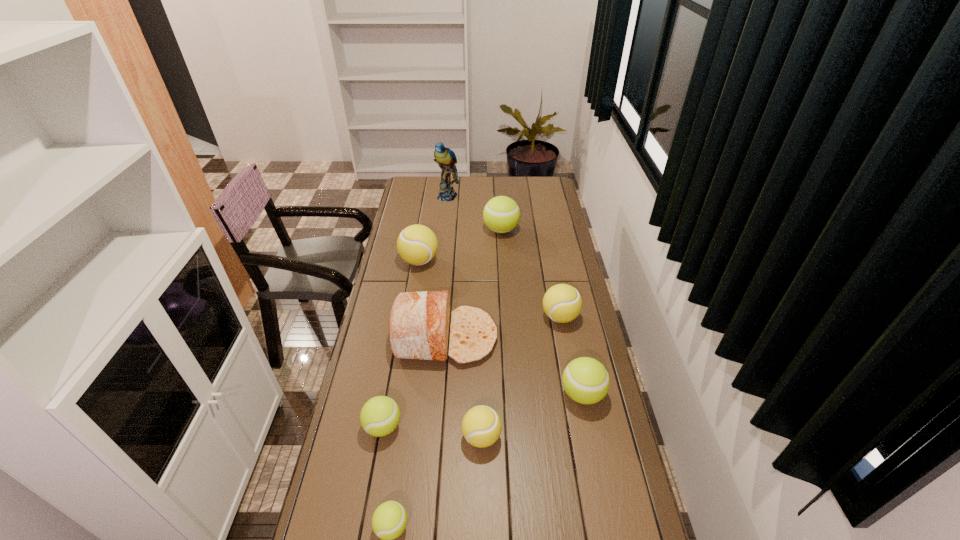
You are a GUI agent. You are given a task and a screenshot of the screen. Output one action in this format:
    pyautogui.click(x=<x>, y=<y>)
    Task: Click on the farthest object
    
    Given the screenshot: What is the action you would take?
    pyautogui.click(x=446, y=159)

This screenshot has height=540, width=960. In order to click on parrot in this screenshot , I will do `click(446, 159)`.

You are a GUI agent. You are given a task and a screenshot of the screen. Output one action in this format:
    pyautogui.click(x=<x>, y=<y>)
    Task: Click on the bread
    The image size is (960, 540).
    Given the screenshot: What is the action you would take?
    pyautogui.click(x=419, y=322)

In order to click on the third farthest object in this screenshot , I will do `click(417, 244)`.

Where is `the leftmost yellow tennis ball`? the leftmost yellow tennis ball is located at coordinates click(417, 244).

Find the location of a particular element. the second green tennis ball from right to left is located at coordinates (501, 214).

Locate an element on the screen. The width and height of the screenshot is (960, 540). the biggest green tennis ball is located at coordinates (501, 214).

The image size is (960, 540). What are the coordinates of `the second smallest yellow tennis ball` in the screenshot? It's located at (562, 303).

Locate an element on the screen. This screenshot has height=540, width=960. the rightmost yellow tennis ball is located at coordinates (562, 303).

You are a GUI agent. You are given a task and a screenshot of the screen. Output one action in this format:
    pyautogui.click(x=<x>, y=<y>)
    Task: Click on the third smallest green tennis ball
    Image resolution: width=960 pixels, height=540 pixels.
    Given the screenshot: What is the action you would take?
    pyautogui.click(x=585, y=380)